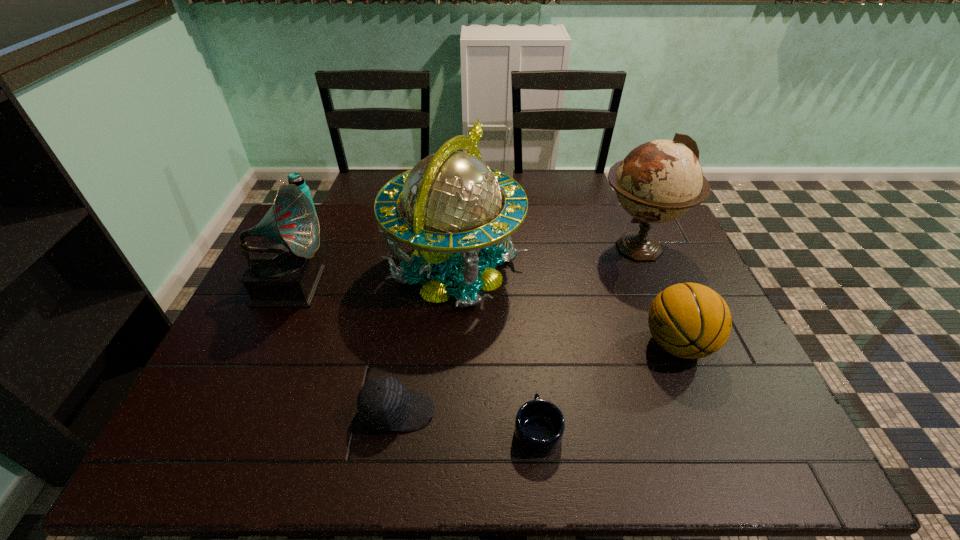
Find the location of a particular element. The height and width of the screenshot is (540, 960). object that is the fourth closest one to the left globe is located at coordinates (539, 426).

Where is `object that is the second closest to the right globe`? The height and width of the screenshot is (540, 960). object that is the second closest to the right globe is located at coordinates (451, 200).

This screenshot has height=540, width=960. I want to click on free location that satisfies the following two spatial constraints: 1. with the handle on the side of the mug; 2. on the horn of the record player, so click(x=522, y=283).